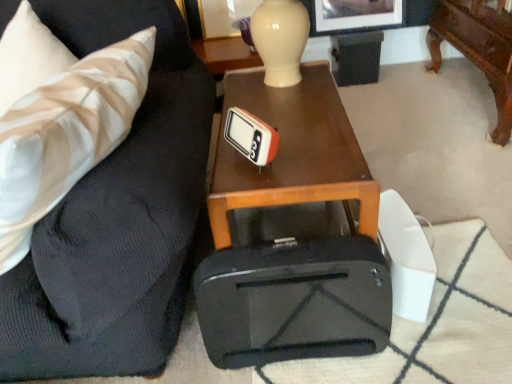
Question: Does black matte suitcase at center appear on the left side of woodenobject at center?

Choices:
 (A) yes
 (B) no

Answer: (B)

Question: Can you confirm if black matte suitcase at center is wider than woodenobject at center?

Choices:
 (A) no
 (B) yes

Answer: (A)

Question: Is woodenobject at center surrounded by black matte suitcase at center?

Choices:
 (A) yes
 (B) no

Answer: (B)

Question: From a real-world perspective, is black matte suitcase at center over woodenobject at center?

Choices:
 (A) yes
 (B) no

Answer: (B)

Question: Is black matte suitcase at center outside woodenobject at center?

Choices:
 (A) no
 (B) yes

Answer: (B)

Question: Is matte black picture frame at upper center, which is the 1th picture frame in right-to-left order, taller or shorter than white striped fabric pillow at left?

Choices:
 (A) short
 (B) tall

Answer: (A)

Question: Considering the positions of matte black picture frame at upper center, the 2th picture frame from the left, and white striped fabric pillow at left in the image, is matte black picture frame at upper center, the 2th picture frame from the left, wider or thinner than white striped fabric pillow at left?

Choices:
 (A) wide
 (B) thin

Answer: (B)

Question: From the image's perspective, is matte black picture frame at upper center, the 2th picture frame from the left, located above or below white striped fabric pillow at left?

Choices:
 (A) below
 (B) above

Answer: (B)

Question: Relative to white striped fabric pillow at left, is matte black picture frame at upper center, which is the 1th picture frame in right-to-left order, in front or behind?

Choices:
 (A) front
 (B) behind

Answer: (B)

Question: From a real-world perspective, relative to black matte suitcase at center, is matte black suitcase at lower right vertically above or below?

Choices:
 (A) below
 (B) above

Answer: (B)

Question: Is matte black suitcase at lower right bigger or smaller than black matte suitcase at center?

Choices:
 (A) small
 (B) big

Answer: (B)

Question: Considering their positions, is matte black suitcase at lower right located in front of or behind black matte suitcase at center?

Choices:
 (A) behind
 (B) front

Answer: (B)

Question: From the image's perspective, is matte black suitcase at lower right above or below black matte suitcase at center?

Choices:
 (A) below
 (B) above

Answer: (B)

Question: Is woodenobject at center to the left or to the right of white striped fabric pillow at left in the image?

Choices:
 (A) left
 (B) right

Answer: (B)

Question: In the image, is woodenobject at center positioned in front of or behind white striped fabric pillow at left?

Choices:
 (A) behind
 (B) front

Answer: (A)